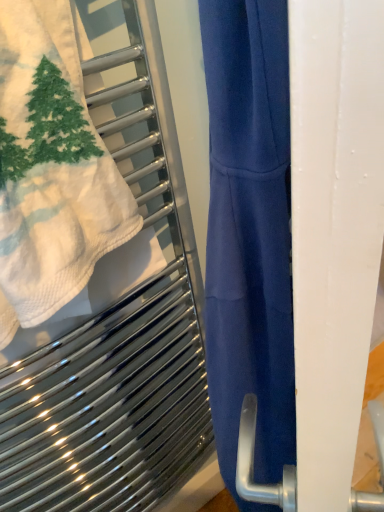
Question: Should I look upward or downward to see white textured towel at upper left?

Choices:
 (A) up
 (B) down

Answer: (A)

Question: Is white matte screen door at right behind white textured towel at upper left?

Choices:
 (A) yes
 (B) no

Answer: (B)

Question: Can you confirm if white matte screen door at right is thinner than white textured towel at upper left?

Choices:
 (A) no
 (B) yes

Answer: (B)

Question: From a real-world perspective, is white matte screen door at right positioned under white textured towel at upper left based on gravity?

Choices:
 (A) no
 (B) yes

Answer: (B)

Question: Is white matte screen door at right in front of white textured towel at upper left?

Choices:
 (A) no
 (B) yes

Answer: (B)

Question: Is white textured towel at upper left inside white matte screen door at right?

Choices:
 (A) yes
 (B) no

Answer: (B)

Question: Does white matte screen door at right have a lesser height compared to white textured towel at upper left?

Choices:
 (A) yes
 (B) no

Answer: (B)

Question: Does white textured towel at upper left turn towards white matte screen door at right?

Choices:
 (A) yes
 (B) no

Answer: (B)

Question: Is white textured towel at upper left completely or partially outside of white matte screen door at right?

Choices:
 (A) yes
 (B) no

Answer: (A)

Question: Does white textured towel at upper left have a smaller size compared to white matte screen door at right?

Choices:
 (A) yes
 (B) no

Answer: (A)

Question: Is the depth of white textured towel at upper left greater than that of white matte screen door at right?

Choices:
 (A) no
 (B) yes

Answer: (B)

Question: Can you confirm if white textured towel at upper left is taller than white matte screen door at right?

Choices:
 (A) yes
 (B) no

Answer: (B)

Question: Is white textured towel at upper left at the left side of white matte screen door at right?

Choices:
 (A) yes
 (B) no

Answer: (A)

Question: In the image, is white textured towel at upper left positioned in front of or behind white matte screen door at right?

Choices:
 (A) behind
 (B) front

Answer: (A)